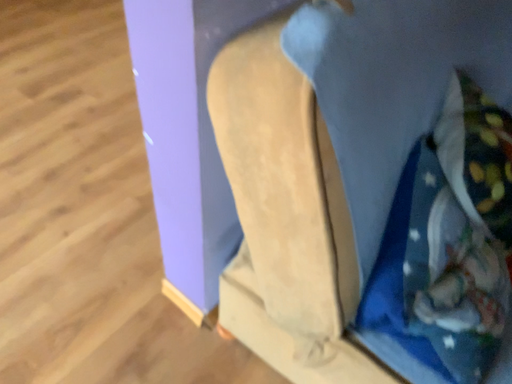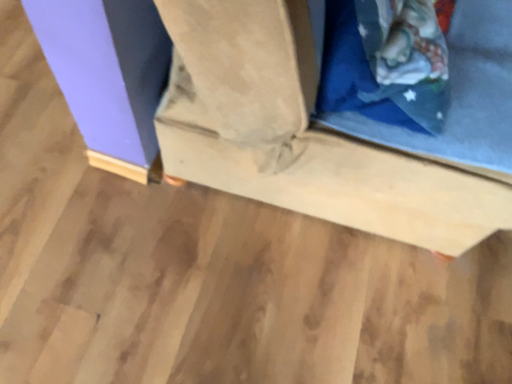
Question: How did the camera likely rotate when shooting the video?

Choices:
 (A) rotated right
 (B) rotated left

Answer: (A)